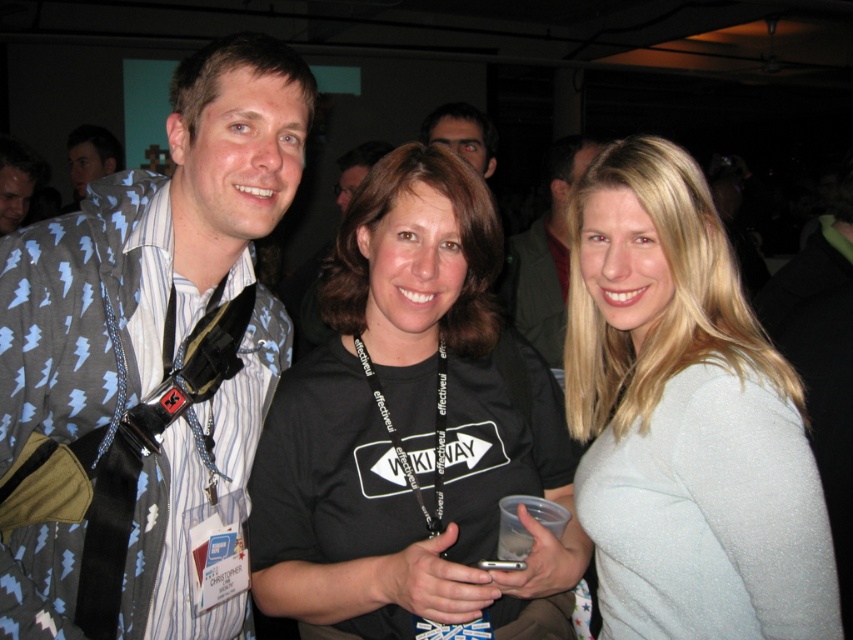
Question: Is light blue and white striped shirt at left thinner than light blue patterned shirt at left?

Choices:
 (A) no
 (B) yes

Answer: (B)

Question: Estimate the real-world distances between objects in this image. Which object is closer to the black matte shirt at center?

Choices:
 (A) satin silver sweater at right
 (B) matte black shirt at center
 (C) light blue patterned shirt at left

Answer: (A)

Question: Which object is closer to the camera taking this photo?

Choices:
 (A) green textured jacket at center
 (B) black matte shirt at center
 (C) light blue and white striped shirt at left

Answer: (B)

Question: Does black matte shirt at center come in front of satin silver sweater at right?

Choices:
 (A) no
 (B) yes

Answer: (B)

Question: Which point is closer to the camera?

Choices:
 (A) light blue and white striped shirt at left
 (B) green textured jacket at center

Answer: (A)

Question: Does light blue and white striped shirt at left come in front of satin silver sweater at right?

Choices:
 (A) yes
 (B) no

Answer: (B)